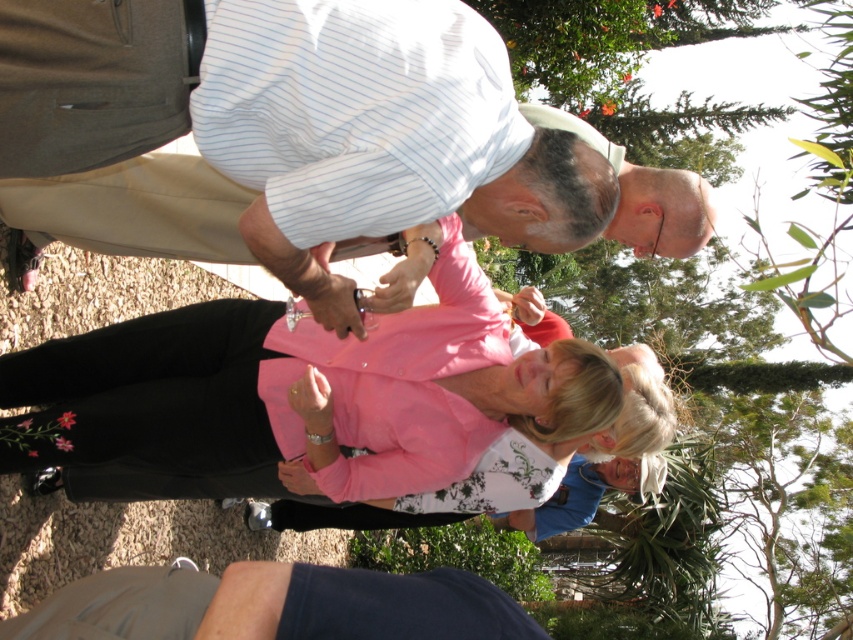
Question: Which object is farther from the camera taking this photo?

Choices:
 (A) pink fabric blouse at center
 (B) white striped shirt at upper center
 (C) dark blue fabric at lower center

Answer: (A)

Question: Can you confirm if white striped shirt at upper center is thinner than dark blue fabric at lower center?

Choices:
 (A) no
 (B) yes

Answer: (A)

Question: Does white striped shirt at upper center appear on the left side of dark blue fabric at lower center?

Choices:
 (A) no
 (B) yes

Answer: (A)

Question: Which object is closer to the camera taking this photo?

Choices:
 (A) dark blue fabric at lower center
 (B) white striped shirt at upper center

Answer: (B)

Question: Considering the relative positions of white striped shirt at upper center and pink fabric blouse at center in the image provided, where is white striped shirt at upper center located with respect to pink fabric blouse at center?

Choices:
 (A) left
 (B) right

Answer: (B)

Question: Which of the following is the farthest from the observer?

Choices:
 (A) (84, 612)
 (B) (15, 83)
 (C) (120, 483)

Answer: (C)